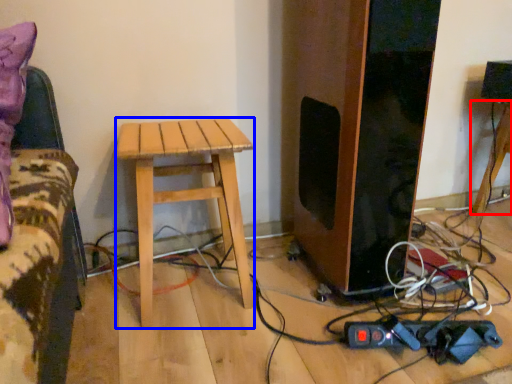
Question: Which point is further to the camera, table (highlighted by a red box) or stool (highlighted by a blue box)?

Choices:
 (A) table
 (B) stool

Answer: (A)